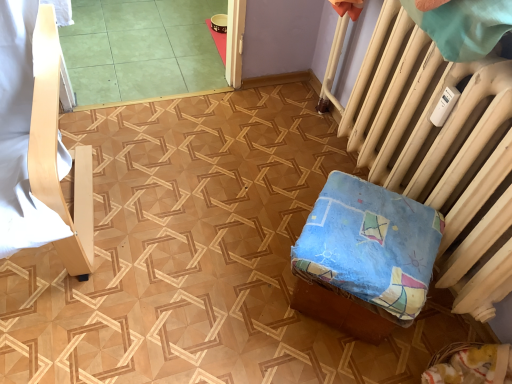
Identify the location of free region on the left part of blue fabric cushion at lower right, which appears as the first furniture when viewed from the right. (245, 284).